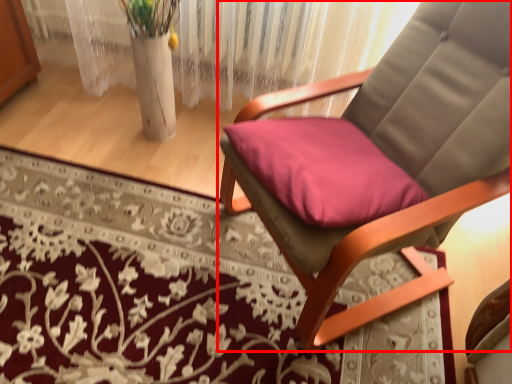
Question: From the image, what is the correct spatial relationship of chair (annotated by the red box) in relation to mat?

Choices:
 (A) left
 (B) right

Answer: (B)